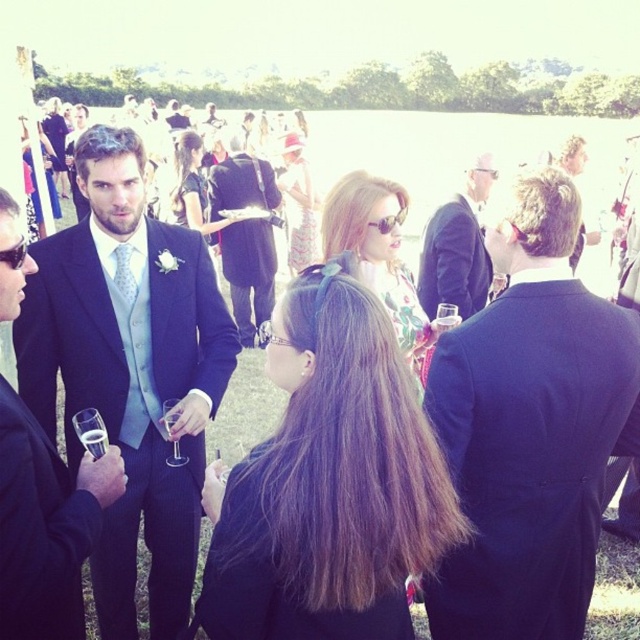
You are a photographer at a formal event. You need to take a group photo of the attendees. The black suit at center and the matte black suit at left are in the frame. Which one should you focus on first if you want to capture the larger person?

The black suit at center is bigger than the matte black suit at left, so you should focus on the black suit at center first to capture the larger person.

Looking at this image, you are a photographer at the event and need to capture both the black suit at center and the matte black suit at left in a single shot. Based on their positions, which one is positioned higher in the frame?

The black suit at center is positioned higher in the frame than the matte black suit at left.

You are a photographer at a formal event and need to capture a photo of both the black suit at center and the matte black dress at center. Which one should you focus on first if you want to ensure both are in frame without adjusting your camera angle?

The black suit at center has a greater height compared to the matte black dress at center, so you should focus on the black suit at center first to ensure both are in frame without adjusting your camera angle.